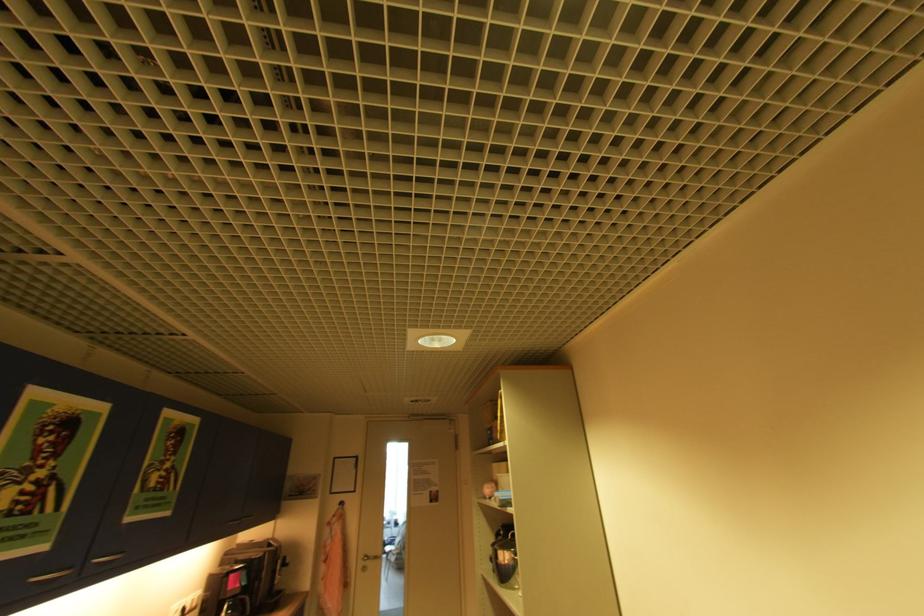
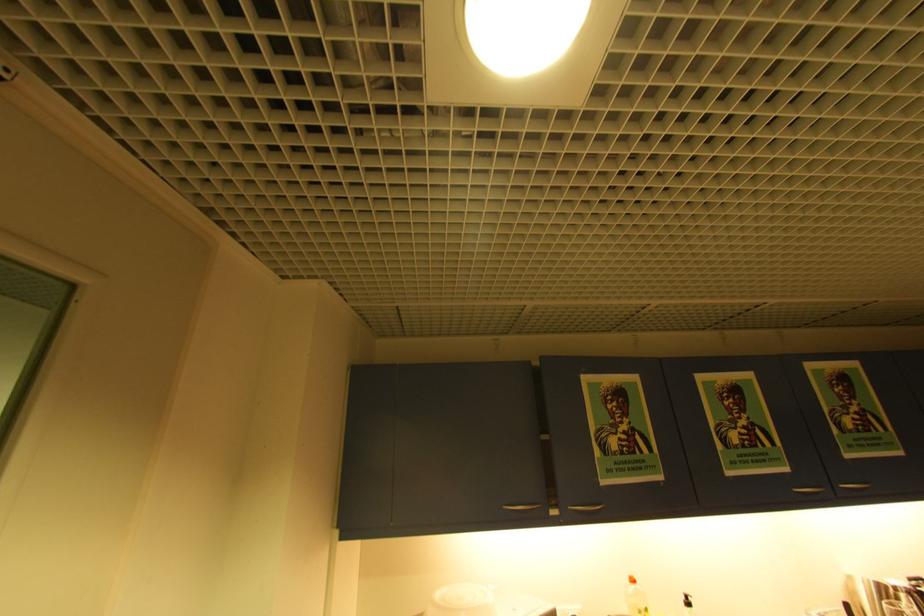
How did the camera likely rotate?

The camera's rotation is toward left-up.